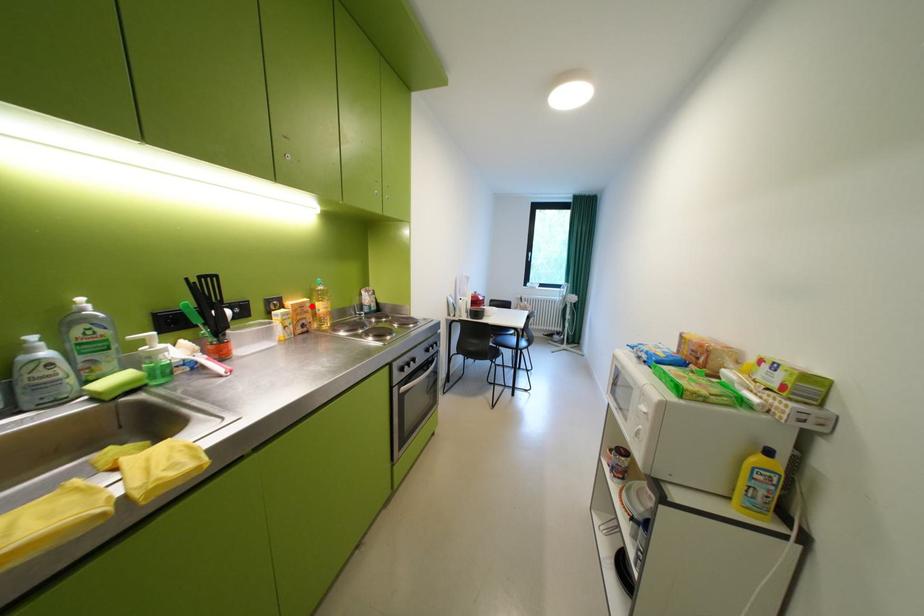
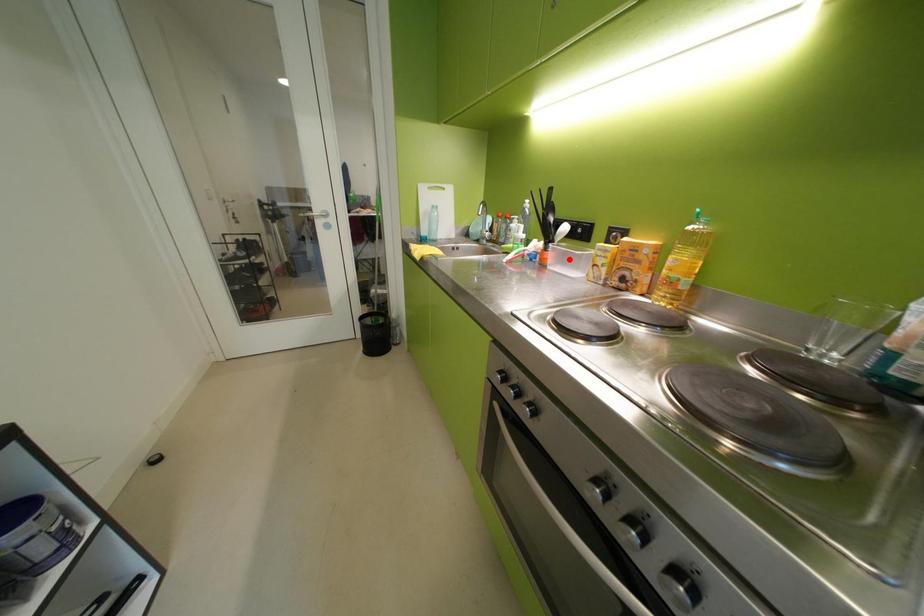
I am providing you with two images of the same scene from different viewpoints. A red point is marked on the first image and another point is marked on the second image. Is the red point in image1 aligned with the point shown in image2?

No